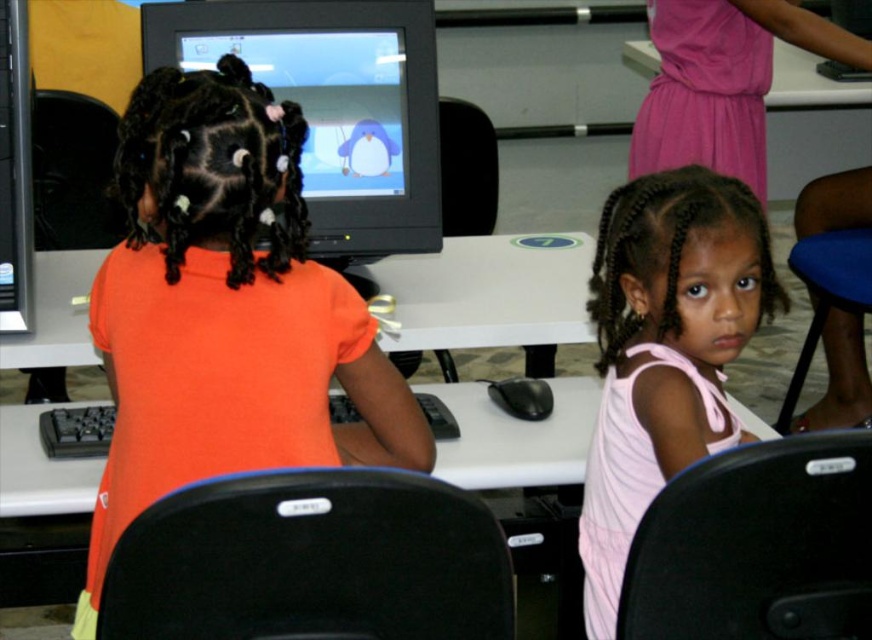
You are a GUI agent. You are given a task and a screenshot of the screen. Output one action in this format:
    pyautogui.click(x=<x>, y=<y>)
    Task: Click on the pink satin dress at center
    The image size is (872, 640).
    Given the screenshot: What is the action you would take?
    pyautogui.click(x=664, y=349)

Who is more forward, (604, 244) or (18, 19)?

Point (604, 244) is in front.

Find the location of a particular element. The image size is (872, 640). pink satin dress at center is located at coordinates (664, 349).

Who is lower down, pink satin dress at center or white glossy table at upper center?

pink satin dress at center is below.

Is pink satin dress at center positioned at the back of white glossy table at upper center?

That is False.

Who is more distant from viewer, (649, 301) or (835, 104)?

Point (835, 104)

Identify the location of pink satin dress at center. (664, 349).

Which of these two, pink satin dress at center or matte black monitor at upper center, stands taller?

pink satin dress at center

Is pink satin dress at center smaller than matte black monitor at upper center?

Yes, pink satin dress at center is smaller than matte black monitor at upper center.

This screenshot has width=872, height=640. What do you see at coordinates (664, 349) in the screenshot?
I see `pink satin dress at center` at bounding box center [664, 349].

This screenshot has height=640, width=872. I want to click on pink satin dress at center, so click(x=664, y=349).